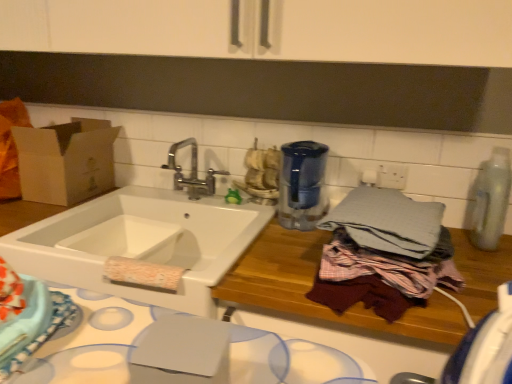
Question: Does brown cardboard box at left contain clear plastic bottle at right, the 1th appliance viewed from the right?

Choices:
 (A) yes
 (B) no

Answer: (B)

Question: Can you confirm if brown cardboard box at left is taller than clear plastic bottle at right, marked as the 2th appliance in a left-to-right arrangement?

Choices:
 (A) yes
 (B) no

Answer: (B)

Question: Is the depth of brown cardboard box at left less than that of clear plastic bottle at right, marked as the 2th appliance in a left-to-right arrangement?

Choices:
 (A) no
 (B) yes

Answer: (A)

Question: Is brown cardboard box at left at the right side of clear plastic bottle at right, marked as the 2th appliance in a left-to-right arrangement?

Choices:
 (A) yes
 (B) no

Answer: (B)

Question: Considering the relative sizes of brown cardboard box at left and clear plastic bottle at right, the 1th appliance viewed from the right, in the image provided, is brown cardboard box at left wider than clear plastic bottle at right, the 1th appliance viewed from the right,?

Choices:
 (A) yes
 (B) no

Answer: (A)

Question: Is blue fabric cloth at lower left situated inside brown cardboard box at left or outside?

Choices:
 (A) inside
 (B) outside

Answer: (B)

Question: Considering the positions of point (3, 327) and point (86, 152), is point (3, 327) closer or farther from the camera than point (86, 152)?

Choices:
 (A) closer
 (B) farther

Answer: (A)

Question: From the image's perspective, is blue fabric cloth at lower left positioned above or below brown cardboard box at left?

Choices:
 (A) above
 (B) below

Answer: (B)

Question: Relative to brown cardboard box at left, is blue fabric cloth at lower left in front or behind?

Choices:
 (A) behind
 (B) front

Answer: (B)

Question: In the image, is blue glass water filter at center, acting as the second appliance starting from the right, on the left side or the right side of white ceramic sink at center?

Choices:
 (A) right
 (B) left

Answer: (A)

Question: Do you think blue glass water filter at center, acting as the second appliance starting from the right, is within white ceramic sink at center, or outside of it?

Choices:
 (A) outside
 (B) inside

Answer: (A)

Question: In terms of width, does blue glass water filter at center, acting as the second appliance starting from the right, look wider or thinner when compared to white ceramic sink at center?

Choices:
 (A) thin
 (B) wide

Answer: (A)

Question: From the image's perspective, is blue glass water filter at center, the 1th appliance when ordered from left to right, above or below white ceramic sink at center?

Choices:
 (A) below
 (B) above

Answer: (B)

Question: Is gray cotton bath towel at right inside the boundaries of blue fabric cloth at lower left, or outside?

Choices:
 (A) outside
 (B) inside

Answer: (A)

Question: From a real-world perspective, relative to blue fabric cloth at lower left, is gray cotton bath towel at right vertically above or below?

Choices:
 (A) below
 (B) above

Answer: (B)